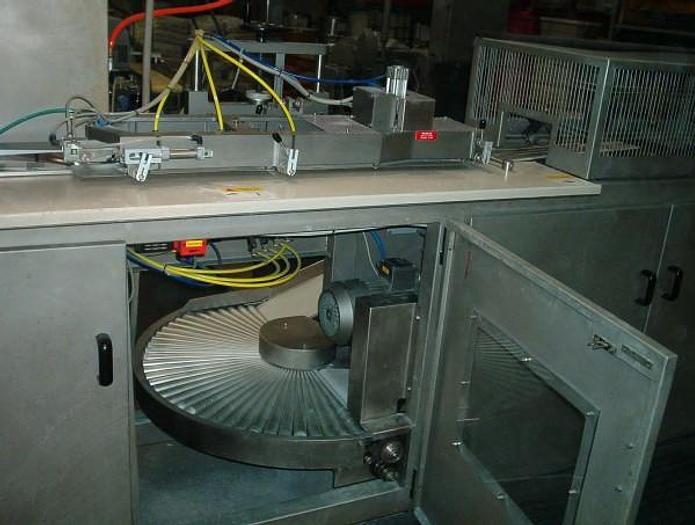
Where is `white cord`? This screenshot has height=525, width=695. white cord is located at coordinates (327, 97).